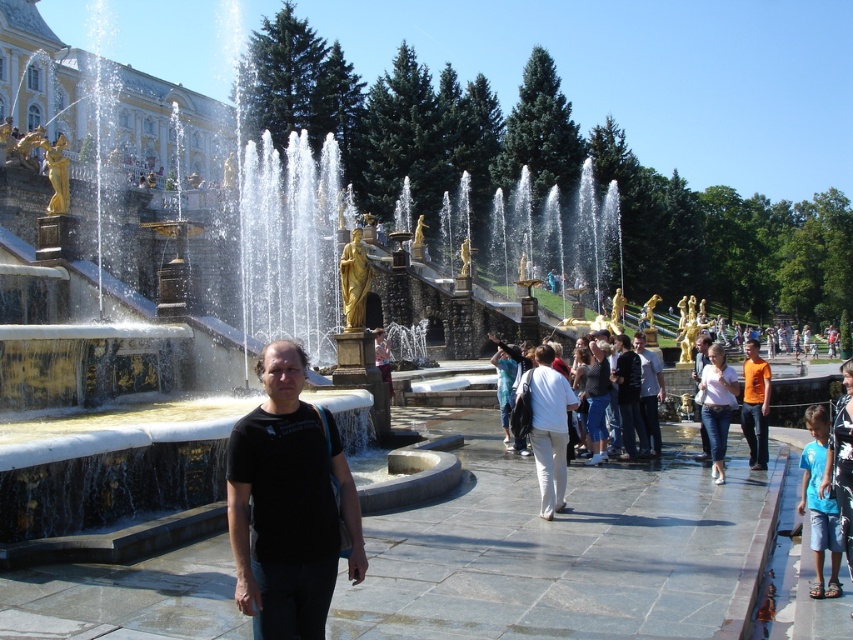
You are standing at the center of the fountain and want to take a photo of both the point at coordinates point (764, 449) and the point at coordinates point (373, 330). Which point will appear larger in your camera view?

Point (764, 449) is closer to the camera than point (373, 330), so it will appear larger in the camera view.

You are standing at the point marked by the coordinates point (717, 404). Looking around, you see the denim jeans at center. Which direction should you walk to reach the grand fountain with multiple jets of water shooting upwards?

The denim jeans at center is located at point (717, 404). Since the grand fountain with multiple jets of water shooting upwards is the central feature of the scene, you should walk towards the center of the image from your current position to reach it.